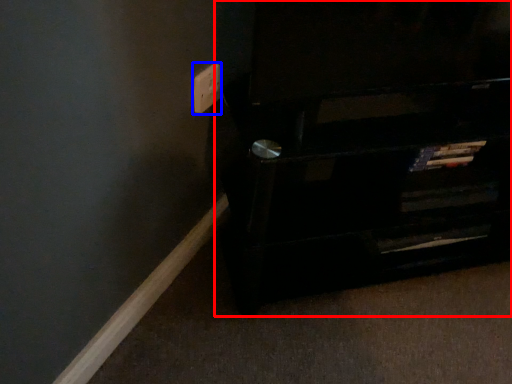
Question: Which object is closer to the camera taking this photo, furniture (highlighted by a red box) or electric outlet (highlighted by a blue box)?

Choices:
 (A) furniture
 (B) electric outlet

Answer: (A)